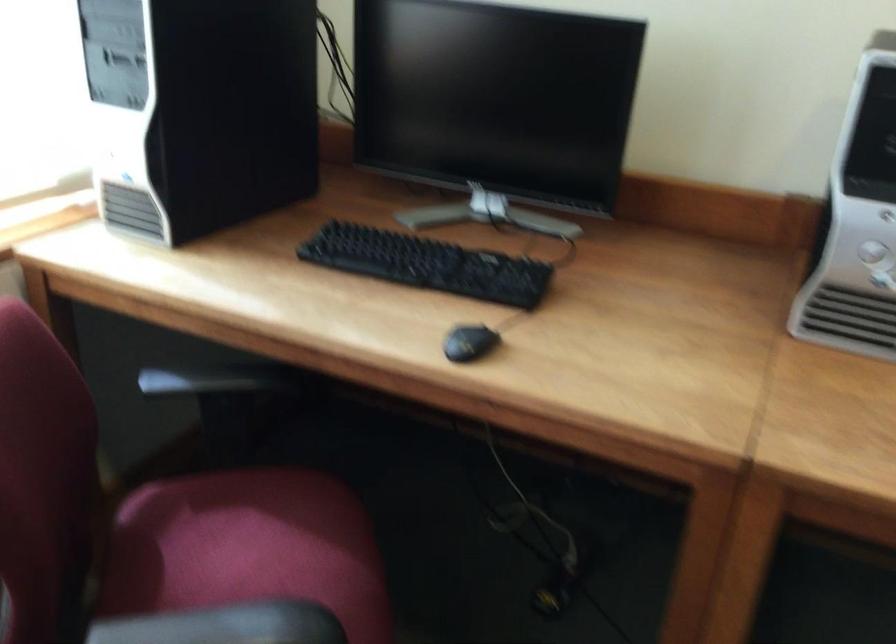
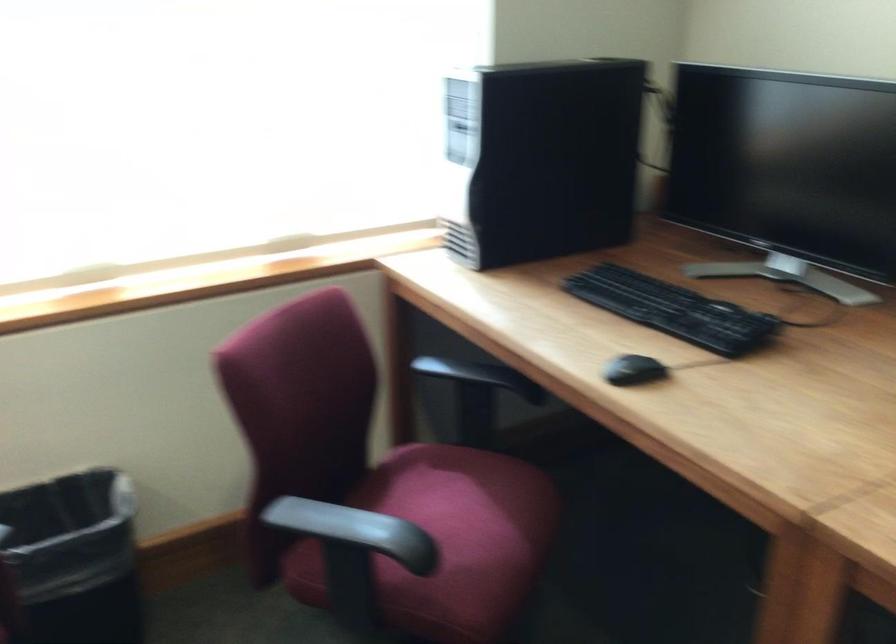
Question: Based on the continuous images, in which direction is the camera rotating? Reply with the corresponding letter.

Choices:
 (A) Left
 (B) Right
 (C) Up
 (D) Down

Answer: (A)